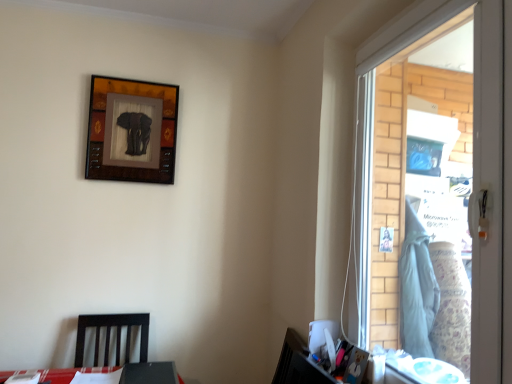
Question: Considering the positions of clear glass window at right and dark wood chair at lower left in the image, is clear glass window at right wider or thinner than dark wood chair at lower left?

Choices:
 (A) thin
 (B) wide

Answer: (A)

Question: Looking at the image, does clear glass window at right seem bigger or smaller compared to dark wood chair at lower left?

Choices:
 (A) big
 (B) small

Answer: (A)

Question: Based on their relative distances, which object is nearer to the clear glass window at right?

Choices:
 (A) dark wood chair at lower left
 (B) wooden elephant art at upper left

Answer: (B)

Question: Based on their relative distances, which object is nearer to the clear glass window at right?

Choices:
 (A) wooden elephant art at upper left
 (B) dark wood chair at lower left

Answer: (A)